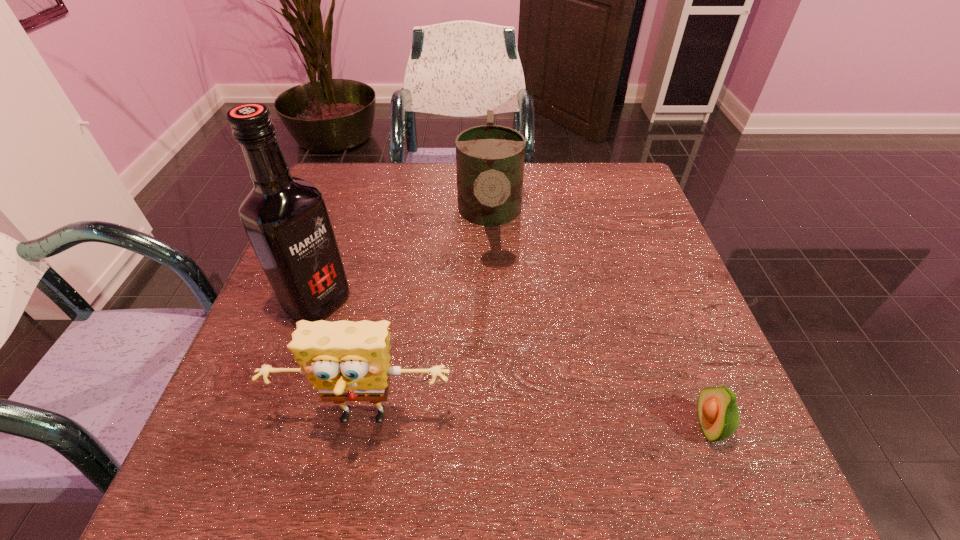
Locate an element on the screen. The width and height of the screenshot is (960, 540). free space between the tallest object and the avocado is located at coordinates (514, 364).

I want to click on empty space between the shortest object and the third nearest object, so click(514, 364).

The image size is (960, 540). What are the coordinates of `free space between the watering can and the rightmost object` in the screenshot? It's located at (599, 322).

At what (x,y) coordinates should I click in order to perform the action: click on free space between the farthest object and the rightmost object. Please return your answer as a coordinate pair (x, y). This screenshot has width=960, height=540. Looking at the image, I should click on (599, 322).

Where is `unoccupied area between the sponge and the farthest object`? This screenshot has height=540, width=960. unoccupied area between the sponge and the farthest object is located at coordinates (427, 319).

Where is `vacant area between the farthest object and the sponge`? This screenshot has height=540, width=960. vacant area between the farthest object and the sponge is located at coordinates (427, 319).

Find the location of a particular element. This screenshot has height=540, width=960. free spot between the tallest object and the shortest object is located at coordinates (514, 364).

In order to click on object that stands as the second closest to the avocado in this screenshot , I will do `click(490, 158)`.

The height and width of the screenshot is (540, 960). Identify the location of object that can be found as the third closest to the liquor. (718, 413).

You are a GUI agent. You are given a task and a screenshot of the screen. Output one action in this format:
    pyautogui.click(x=<x>, y=<y>)
    Task: Click on the free region that satisfies the following two spatial constraints: 1. on the face of the sponge; 2. on the cut side of the rightmost object
    The image size is (960, 540).
    Given the screenshot: What is the action you would take?
    pyautogui.click(x=363, y=426)